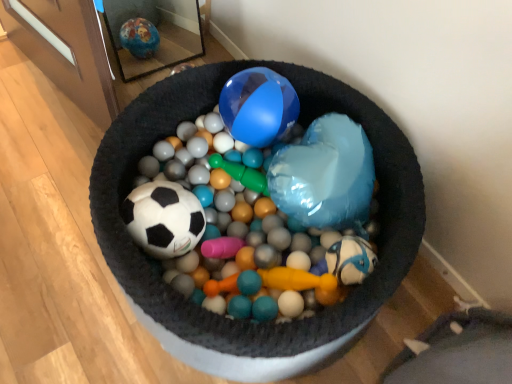
Question: Is gray fabric bean bag chair at lower right taller or shorter than matte black soccer ball at center?

Choices:
 (A) short
 (B) tall

Answer: (A)

Question: From the image's perspective, is gray fabric bean bag chair at lower right located above or below matte black soccer ball at center?

Choices:
 (A) below
 (B) above

Answer: (A)

Question: Is gray fabric bean bag chair at lower right to the left or to the right of matte black soccer ball at center in the image?

Choices:
 (A) left
 (B) right

Answer: (B)

Question: Relative to gray fabric bean bag chair at lower right, is matte black soccer ball at center in front or behind?

Choices:
 (A) front
 (B) behind

Answer: (A)

Question: Considering the positions of matte black soccer ball at center and gray fabric bean bag chair at lower right in the image, is matte black soccer ball at center taller or shorter than gray fabric bean bag chair at lower right?

Choices:
 (A) short
 (B) tall

Answer: (B)

Question: From a real-world perspective, is matte black soccer ball at center positioned above or below gray fabric bean bag chair at lower right?

Choices:
 (A) below
 (B) above

Answer: (B)

Question: Is matte black soccer ball at center inside the boundaries of gray fabric bean bag chair at lower right, or outside?

Choices:
 (A) outside
 (B) inside

Answer: (A)